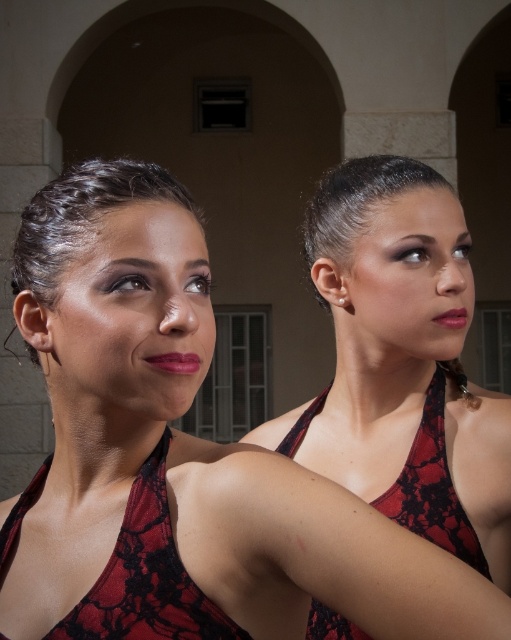
Question: Based on their relative distances, which object is nearer to the red lace dress at center?

Choices:
 (A) matte pink lipstick at center
 (B) matte red lipstick at right
 (C) lace fabric dress at center

Answer: (C)

Question: Among these objects, which one is farthest from the camera?

Choices:
 (A) lace fabric dress at center
 (B) red lace dress at center
 (C) matte pink lipstick at center
 (D) matte red lipstick at right

Answer: (D)

Question: Is lace fabric dress at center thinner than matte red lipstick at right?

Choices:
 (A) no
 (B) yes

Answer: (A)

Question: Does lace fabric dress at center come behind matte red lipstick at right?

Choices:
 (A) yes
 (B) no

Answer: (B)

Question: Does red lace dress at center appear on the left side of matte red lipstick at right?

Choices:
 (A) no
 (B) yes

Answer: (B)

Question: Based on their relative distances, which object is nearer to the matte pink lipstick at center?

Choices:
 (A) lace fabric dress at center
 (B) matte red lipstick at right
 (C) red lace dress at center

Answer: (A)